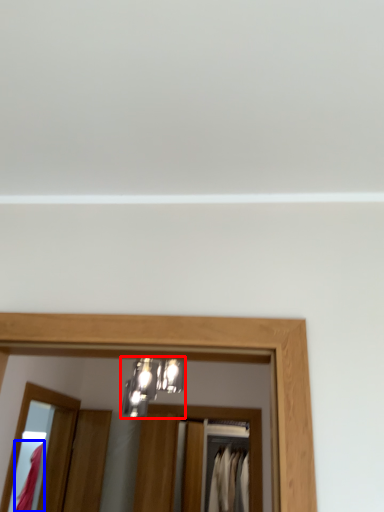
Question: Which point is further to the camera, light fixture (highlighted by a red box) or clothing (highlighted by a blue box)?

Choices:
 (A) light fixture
 (B) clothing

Answer: (B)